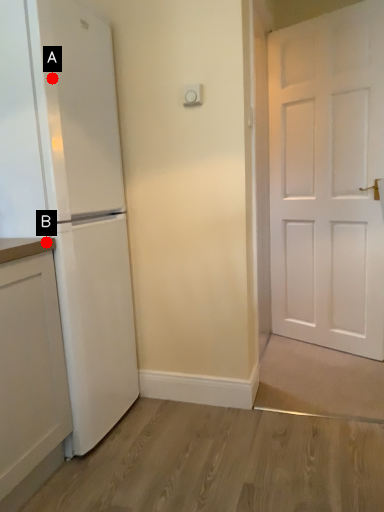
Question: Two points are circled on the image, labeled by A and B beside each circle. Which point is farther to the camera?

Choices:
 (A) A is further
 (B) B is further

Answer: (A)